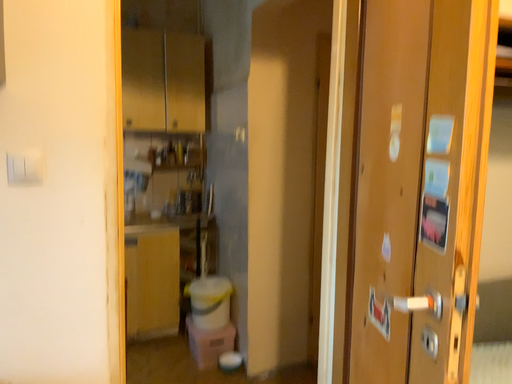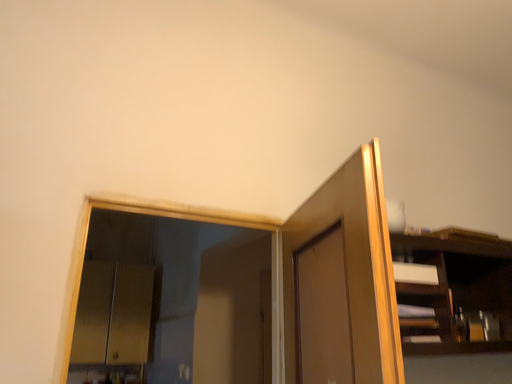
Question: How did the camera likely rotate when shooting the video?

Choices:
 (A) rotated downward
 (B) rotated upward

Answer: (B)